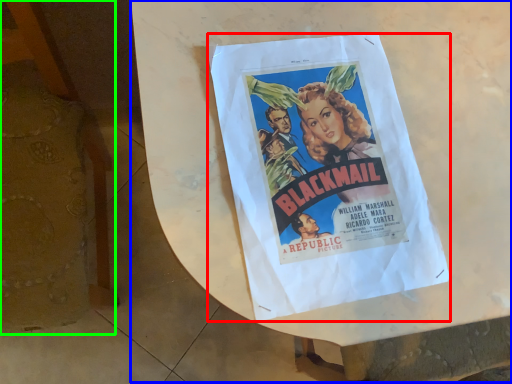
Question: Which object is the closest to the poster (highlighted by a red box)? Choose among these: round table (highlighted by a blue box) or furniture (highlighted by a green box).

Choices:
 (A) round table
 (B) furniture

Answer: (A)